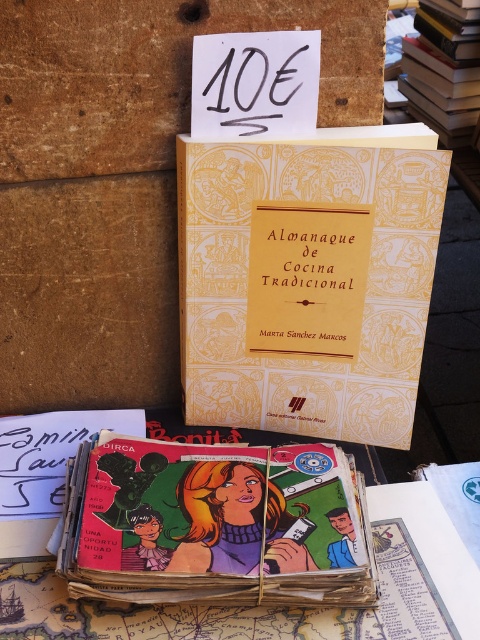
Does colorful glossy comic book at lower center have a lesser height compared to yellow paper-covered book at upper right?

Yes, colorful glossy comic book at lower center is shorter than yellow paper-covered book at upper right.

Who is shorter, colorful glossy comic book at lower center or yellow paper-covered book at upper right?

With less height is colorful glossy comic book at lower center.

Who is more forward, (66, 573) or (451, 81)?

Point (66, 573) is in front.

What are the coordinates of `colorful glossy comic book at lower center` in the screenshot? It's located at (216, 524).

How much distance is there between gold-patterned book at center and yellow paper-covered book at upper right?

A distance of 1.11 meters exists between gold-patterned book at center and yellow paper-covered book at upper right.

At what (x,y) coordinates should I click in order to perform the action: click on gold-patterned book at center. Please return your answer as a coordinate pair (x, y). The height and width of the screenshot is (640, 480). Looking at the image, I should click on (x=365, y=289).

From the picture: Who is more distant from viewer, (280, 198) or (142, 444)?

The point (280, 198) is behind.

Can you confirm if gold-patterned book at center is positioned above colorful glossy comic book at lower center?

Yes, gold-patterned book at center is above colorful glossy comic book at lower center.

Does point (364, 184) lie behind point (351, 497)?

Yes, it is.

Locate an element on the screen. The width and height of the screenshot is (480, 640). gold-patterned book at center is located at coordinates (365, 289).